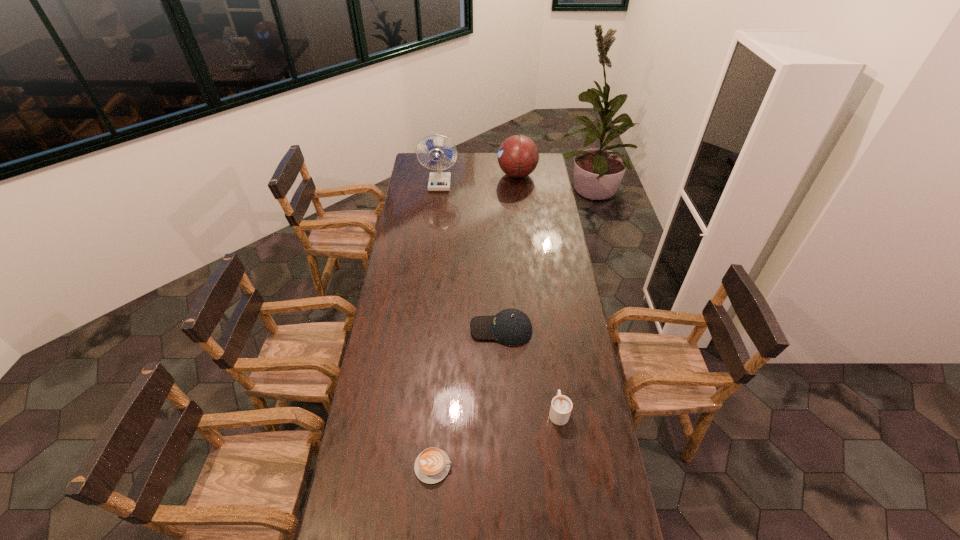
Image resolution: width=960 pixels, height=540 pixels. Find the location of `vacant space situated 0.350m on the front-facing side of the baseball cap`. vacant space situated 0.350m on the front-facing side of the baseball cap is located at coordinates (387, 329).

Image resolution: width=960 pixels, height=540 pixels. Identify the location of free location located on the front-facing side of the baseball cap. coord(437,329).

You are a GUI agent. You are given a task and a screenshot of the screen. Output one action in this format:
    pyautogui.click(x=<x>, y=<y>)
    Task: Click on the vacant point located 0.230m on the side with the handle of the taller cappuccino
    
    Given the screenshot: What is the action you would take?
    click(x=550, y=348)

You are a GUI agent. You are given a task and a screenshot of the screen. Output one action in this format:
    pyautogui.click(x=<x>, y=<y>)
    Task: Click on the vacant region located 0.090m on the side with the handle of the taller cappuccino
    This screenshot has height=540, width=960.
    Given the screenshot: What is the action you would take?
    pyautogui.click(x=554, y=377)

Where is `vacant position located 0.290m on the side with the handle of the taller cappuccino`? vacant position located 0.290m on the side with the handle of the taller cappuccino is located at coordinates (548, 336).

Identify the location of vacant space positioned on the side of the shortest object with the handle. The image size is (960, 540). (470, 466).

Locate an element on the screen. object present at the far edge is located at coordinates (518, 156).

In order to click on object located in the left edge section of the desktop in this screenshot , I will do `click(438, 181)`.

Locate an element on the screen. basketball situated at the right edge is located at coordinates (518, 156).

Where is `cappuccino that is positioned at the right edge`? The height and width of the screenshot is (540, 960). cappuccino that is positioned at the right edge is located at coordinates (561, 406).